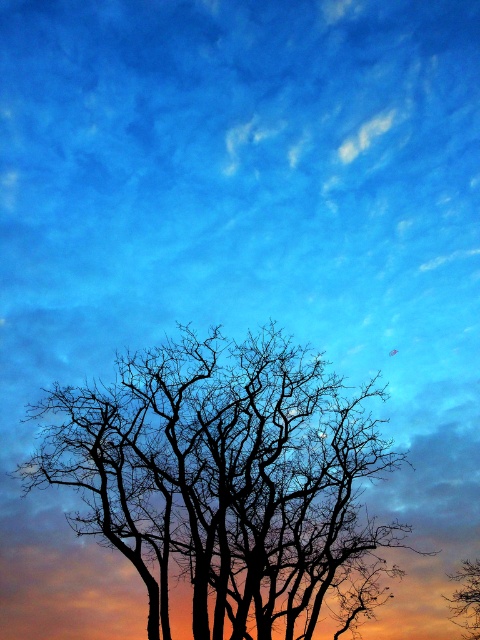
You are an artist observing the scene and want to paint the silhouette bark tree at center and silhouette bare tree at center. Which tree should you paint first if you want to follow the order from top to bottom?

The silhouette bark tree at center should be painted first because it is positioned above the silhouette bare tree at center.

You are an architect designing a garden and want to place a bench between the silhouette bark tree at center and the silhouette bare tree at center. The bench requires a minimum of 10 feet of space between the two trees to fit comfortably. Based on the image, will there be enough space for the bench?

The silhouette bark tree at center is 15.92 feet from the silhouette bare tree at center, which is more than the required 10 feet, so there is enough space for the bench.

You are an artist trying to paint the scene. You want to paint the silhouette bark tree at center and silhouette bare tree at center. Which one should you paint first if you want to layer them correctly?

You should paint the silhouette bare tree at center first because the silhouette bark tree at center is in front of it, so you need to layer the silhouette bark tree at center on top.